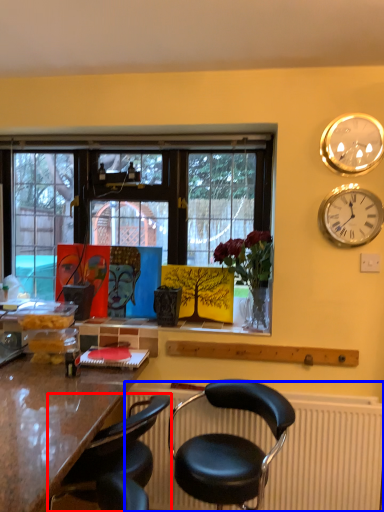
Question: Which object is further to the camera taking this photo, chair (highlighted by a red box) or radiator (highlighted by a blue box)?

Choices:
 (A) chair
 (B) radiator

Answer: (B)